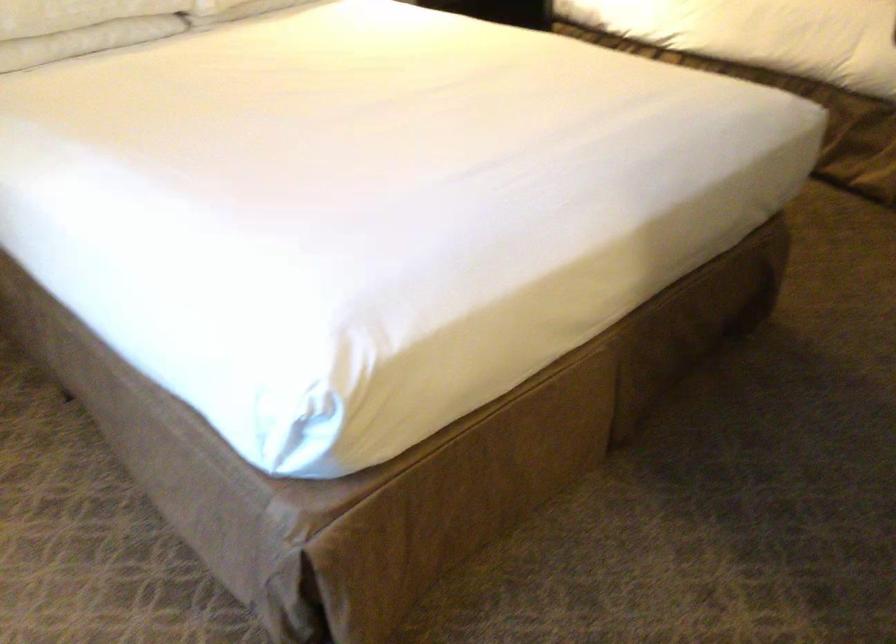
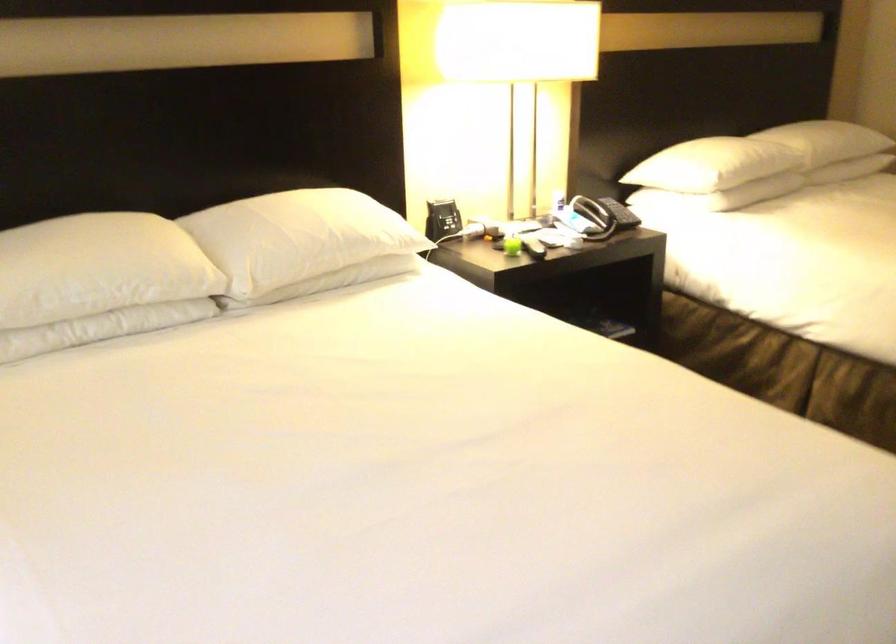
Question: Based on the continuous images, in which direction is the camera rotating? Reply with the corresponding letter.

Choices:
 (A) Left
 (B) Right
 (C) Up
 (D) Down

Answer: (C)